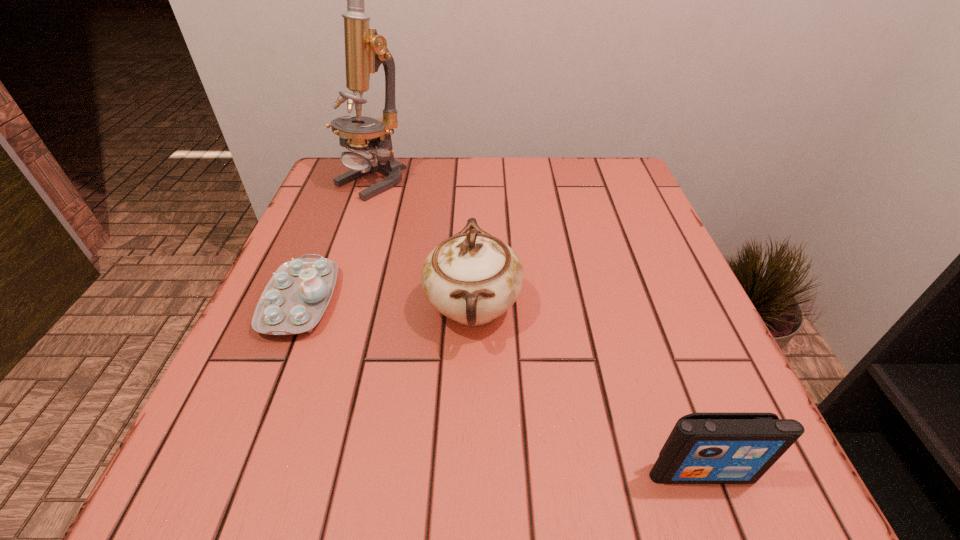
This screenshot has width=960, height=540. Find the location of `the tallest object`. the tallest object is located at coordinates (365, 50).

I want to click on microscope, so [x=365, y=50].

The width and height of the screenshot is (960, 540). Find the location of `the right chinaware`. the right chinaware is located at coordinates (472, 278).

At what (x,y) coordinates should I click in order to perform the action: click on the taller chinaware. Please return your answer as a coordinate pair (x, y). Looking at the image, I should click on (472, 278).

This screenshot has width=960, height=540. What are the coordinates of `iPod` in the screenshot? It's located at (703, 448).

I want to click on the third tallest object, so click(x=703, y=448).

This screenshot has width=960, height=540. In order to click on the shortest object in this screenshot , I will do `click(294, 300)`.

Where is `the left chinaware`? Image resolution: width=960 pixels, height=540 pixels. the left chinaware is located at coordinates (294, 300).

Find the location of `vacant space located on the right of the farthest object`. vacant space located on the right of the farthest object is located at coordinates (525, 181).

Where is `vacant region located 0.180m on the front of the third shortest object`? The width and height of the screenshot is (960, 540). vacant region located 0.180m on the front of the third shortest object is located at coordinates (470, 472).